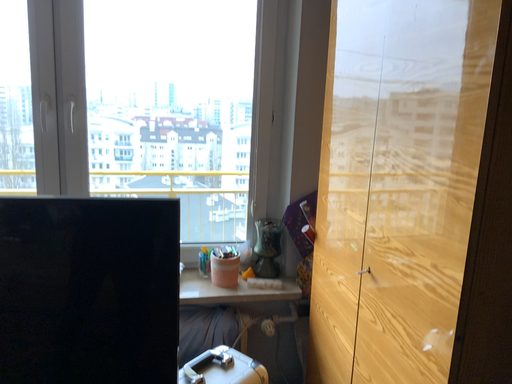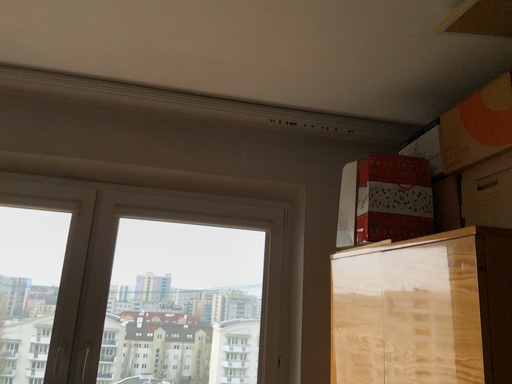
Question: How did the camera likely rotate when shooting the video?

Choices:
 (A) rotated downward
 (B) rotated upward

Answer: (B)